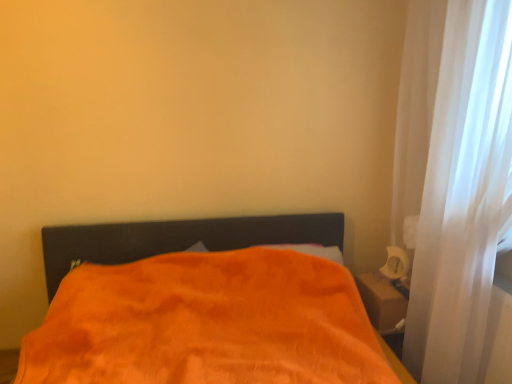
Question: Can you confirm if orange plush blanket at center is positioned to the left of white glossy table lamp at right?

Choices:
 (A) yes
 (B) no

Answer: (A)

Question: From the image's perspective, would you say orange plush blanket at center is positioned over white glossy table lamp at right?

Choices:
 (A) yes
 (B) no

Answer: (B)

Question: Is orange plush blanket at center beside white glossy table lamp at right?

Choices:
 (A) no
 (B) yes

Answer: (A)

Question: Is orange plush blanket at center positioned with its back to white glossy table lamp at right?

Choices:
 (A) yes
 (B) no

Answer: (B)

Question: Considering the relative positions of orange plush blanket at center and white glossy table lamp at right in the image provided, is orange plush blanket at center in front of white glossy table lamp at right?

Choices:
 (A) no
 (B) yes

Answer: (B)

Question: From a real-world perspective, relative to white sheer curtain at right, is orange plush blanket at center vertically above or below?

Choices:
 (A) below
 (B) above

Answer: (A)

Question: Based on their sizes in the image, would you say orange plush blanket at center is bigger or smaller than white sheer curtain at right?

Choices:
 (A) big
 (B) small

Answer: (A)

Question: Is orange plush blanket at center to the left or to the right of white sheer curtain at right in the image?

Choices:
 (A) left
 (B) right

Answer: (A)

Question: Do you think orange plush blanket at center is within white sheer curtain at right, or outside of it?

Choices:
 (A) inside
 (B) outside

Answer: (B)

Question: Considering the positions of point (209, 256) and point (394, 253), is point (209, 256) closer or farther from the camera than point (394, 253)?

Choices:
 (A) closer
 (B) farther

Answer: (A)

Question: In the image, is orange plush blanket at center positioned in front of or behind white glossy table lamp at right?

Choices:
 (A) behind
 (B) front

Answer: (B)

Question: From the image's perspective, is orange plush blanket at center positioned above or below white glossy table lamp at right?

Choices:
 (A) above
 (B) below

Answer: (B)

Question: From a real-world perspective, relative to white glossy table lamp at right, is orange plush blanket at center vertically above or below?

Choices:
 (A) below
 (B) above

Answer: (A)

Question: Considering the positions of white sheer curtain at right and orange plush blanket at center in the image, is white sheer curtain at right taller or shorter than orange plush blanket at center?

Choices:
 (A) tall
 (B) short

Answer: (A)

Question: Would you say white sheer curtain at right is to the left or to the right of orange plush blanket at center in the picture?

Choices:
 (A) left
 (B) right

Answer: (B)